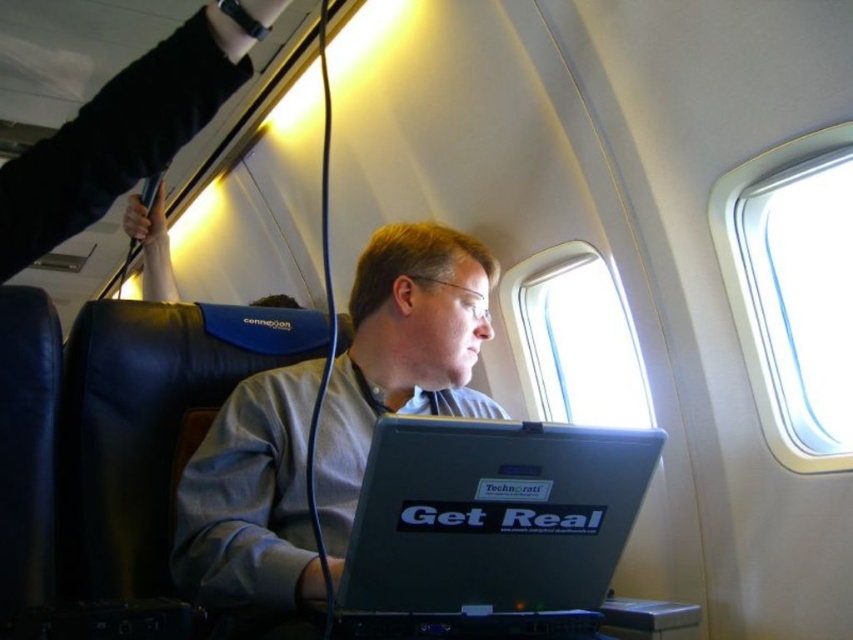
You are a flight attendant checking passengers for safety. You notice the gray matte shirt at center and the clear plastic airplane window at upper right. Which object is larger in the image?

The gray matte shirt at center is bigger than the clear plastic airplane window at upper right.

You are standing in the airplane cabin and want to reach a point located at coordinates point (427, 371). Can you estimate how far this point is from you?

The point (427, 371) is 1.36 meters away from the viewer.

You are a flight attendant observing the scene. You need to determine if the gray matte shirt at center is taller than the clear plastic airplane window at upper right. What is your observation?

The gray matte shirt at center has a lesser height compared to the clear plastic airplane window at upper right, so it is not taller.